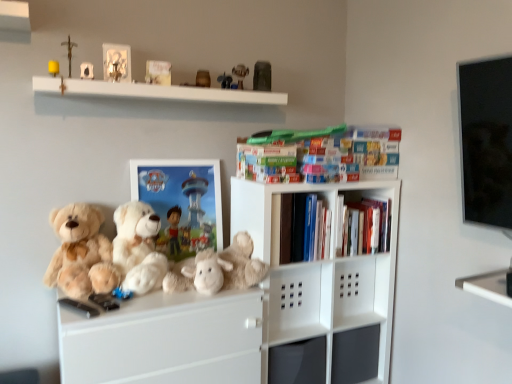
Question: Does point (228, 84) appear closer or farther from the camera than point (285, 226)?

Choices:
 (A) closer
 (B) farther

Answer: (B)

Question: From their relative heights in the image, would you say matte plastic toy at upper center, marked as the sixth toy in a left-to-right arrangement, is taller or shorter than hardcover books at center, arranged as the 3th book when viewed from the left?

Choices:
 (A) tall
 (B) short

Answer: (B)

Question: Considering the real-world distances, which object is closest to the hardcover books at upper center, marked as the 2th book in a top-to-bottom arrangement?

Choices:
 (A) metallic gray figurine at upper center, the first toy in the right-to-left sequence
 (B) matte plastic picture frame at center
 (C) yellow matte candle at upper left, the 1th toy positioned from the left
 (D) plush toy at upper center, which is the second toy in right-to-left order
 (E) matte brown figurine at upper center, the fourth toy when ordered from right to left

Answer: (B)

Question: Estimate the real-world distances between objects in this image. Which object is closer to the matte plastic picture frame at center?

Choices:
 (A) yellow matte candle at upper left, the 8th toy viewed from the right
 (B) plush toy at upper center, placed as the seventh toy when sorted from left to right
 (C) matte plastic toy at upper center, marked as the sixth toy in a left-to-right arrangement
 (D) metal crucifix at upper left, the 2th toy from the left
 (E) matte white photo frame at upper center, the 3th toy positioned from the left

Answer: (C)